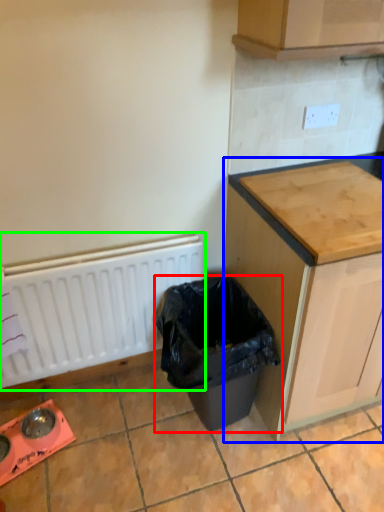
Question: Which object is positioned farthest from waste container (highlighted by a red box)? Select from cabinetry (highlighted by a blue box) and radiator (highlighted by a green box).

Choices:
 (A) cabinetry
 (B) radiator

Answer: (B)